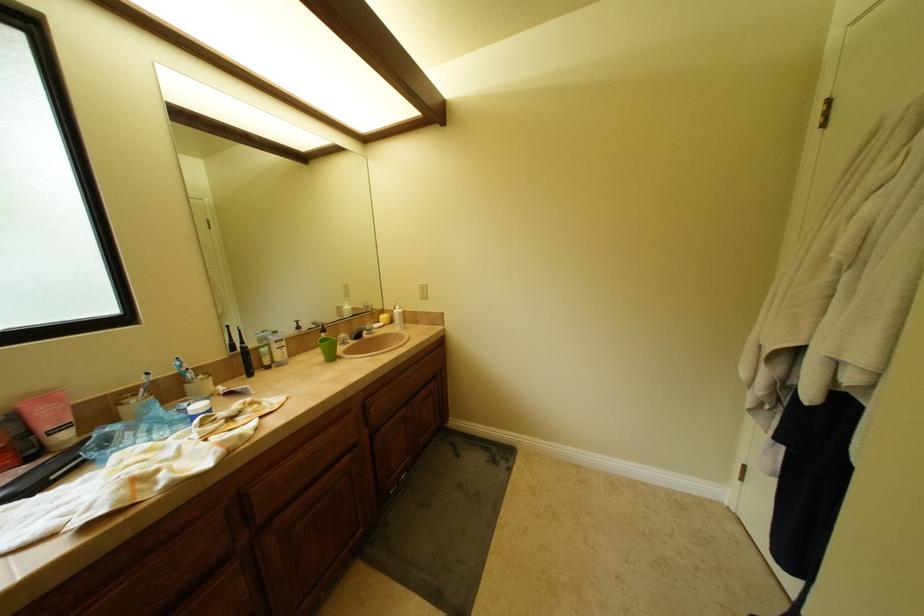
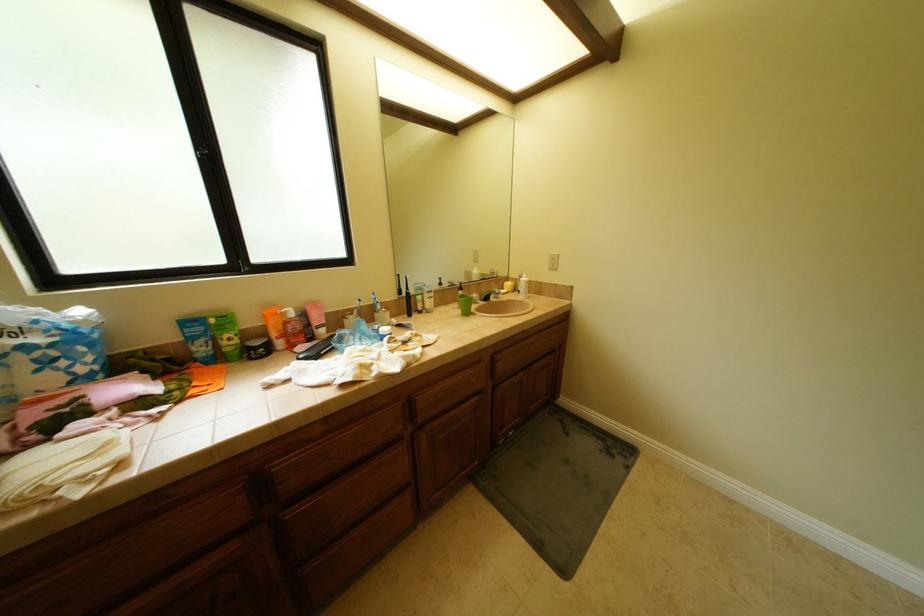
Question: In a continuous first-person perspective shot, in which direction is the camera moving?

Choices:
 (A) Left
 (B) Right
 (C) Forward
 (D) Backward

Answer: (A)